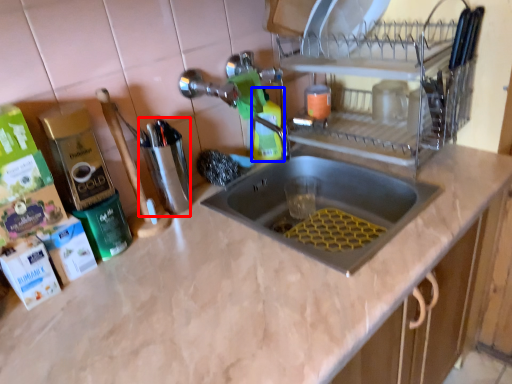
Question: Which object is further to the camera taking this photo, appliance (highlighted by a red box) or cleaning product (highlighted by a blue box)?

Choices:
 (A) appliance
 (B) cleaning product

Answer: (B)